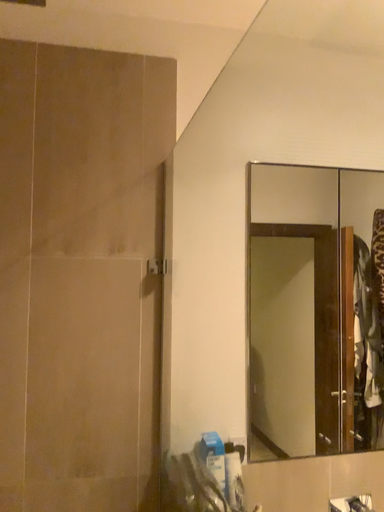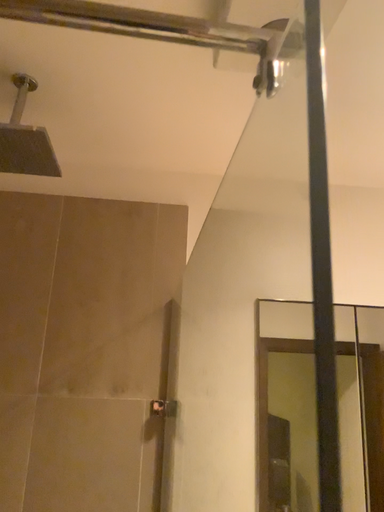
Question: How did the camera likely rotate when shooting the video?

Choices:
 (A) rotated downward
 (B) rotated upward

Answer: (B)